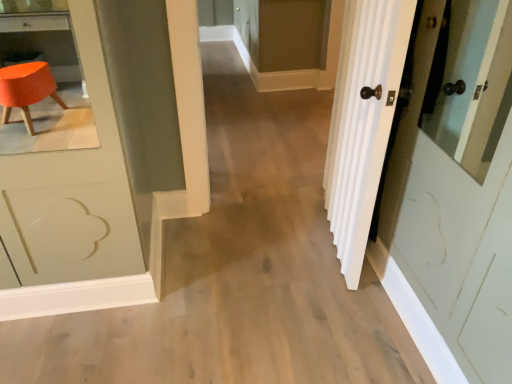
Measure the distance between point (256, 71) and camera.

They are 4.08 meters apart.

Identify the location of matte brown screen door at upper center. This screenshot has width=512, height=384. (301, 70).

The image size is (512, 384). Describe the element at coordinates (301, 70) in the screenshot. I see `matte brown screen door at upper center` at that location.

What do you see at coordinates (362, 121) in the screenshot? The image size is (512, 384). I see `white wood door at right` at bounding box center [362, 121].

This screenshot has width=512, height=384. In order to click on white wood door at right in this screenshot , I will do `click(362, 121)`.

Where is `matte brown screen door at upper center`? matte brown screen door at upper center is located at coordinates (301, 70).

In the image, is matte brown screen door at upper center on the left side or the right side of white wood door at right?

In the image, matte brown screen door at upper center appears on the left side of white wood door at right.

Based on the photo, is matte brown screen door at upper center closer to the viewer compared to white wood door at right?

No, it is not.

Which is in front, point (309, 71) or point (330, 225)?

Point (330, 225)

From the image's perspective, is matte brown screen door at upper center positioned above or below white wood door at right?

Based on their image positions, matte brown screen door at upper center is located above white wood door at right.

From a real-world perspective, which object stands above the other?

white wood door at right, from a real-world perspective.

Does matte brown screen door at upper center have a lesser width compared to white wood door at right?

In fact, matte brown screen door at upper center might be wider than white wood door at right.

Looking at this image, does matte brown screen door at upper center have a greater height compared to white wood door at right?

In fact, matte brown screen door at upper center may be shorter than white wood door at right.

Based on their sizes in the image, would you say matte brown screen door at upper center is bigger or smaller than white wood door at right?

Considering their sizes, matte brown screen door at upper center takes up more space than white wood door at right.

Can white wood door at right be found inside matte brown screen door at upper center?

Definitely not — white wood door at right is not inside matte brown screen door at upper center.

Is matte brown screen door at upper center in contact with white wood door at right?

No, matte brown screen door at upper center is not making contact with white wood door at right.

Is matte brown screen door at upper center turned away from white wood door at right?

No.

Can you tell me how much matte brown screen door at upper center and white wood door at right differ in facing direction?

9.44 degrees.

Locate an element on the screen. The width and height of the screenshot is (512, 384). door on the right of matte brown screen door at upper center is located at coordinates (362, 121).

Is white wood door at right at the right side of matte brown screen door at upper center?

Yes.

Is the depth of white wood door at right less than that of matte brown screen door at upper center?

That is True.

From the picture: Which is closer, (368, 206) or (327, 74)?

Positioned in front is point (368, 206).

From the image's perspective, is white wood door at right located above or below matte brown screen door at upper center?

white wood door at right is situated lower than matte brown screen door at upper center in the image.

From a real-world perspective, is white wood door at right above or below matte brown screen door at upper center?

Clearly, from a real-world perspective, white wood door at right is above matte brown screen door at upper center.

In terms of width, does white wood door at right look wider or thinner when compared to matte brown screen door at upper center?

Clearly, white wood door at right has less width compared to matte brown screen door at upper center.

Between white wood door at right and matte brown screen door at upper center, which one has less height?

matte brown screen door at upper center is shorter.

From the picture: Between white wood door at right and matte brown screen door at upper center, which one has larger size?

With larger size is matte brown screen door at upper center.

Could matte brown screen door at upper center be considered to be inside white wood door at right?

No, white wood door at right does not contain matte brown screen door at upper center.

Is there a large distance between white wood door at right and matte brown screen door at upper center?

white wood door at right is far away from matte brown screen door at upper center.

Is white wood door at right facing towards matte brown screen door at upper center?

No, white wood door at right is not turned towards matte brown screen door at upper center.

Image resolution: width=512 pixels, height=384 pixels. What are the coordinates of `screen door to the left of white wood door at right` in the screenshot? It's located at (301, 70).

Find the location of a particular element. This screenshot has width=512, height=384. door that is below the matte brown screen door at upper center (from the image's perspective) is located at coordinates (362, 121).

At what (x,y) coordinates should I click in order to perform the action: click on door located above the matte brown screen door at upper center (from a real-world perspective). Please return your answer as a coordinate pair (x, y). Looking at the image, I should click on (362, 121).